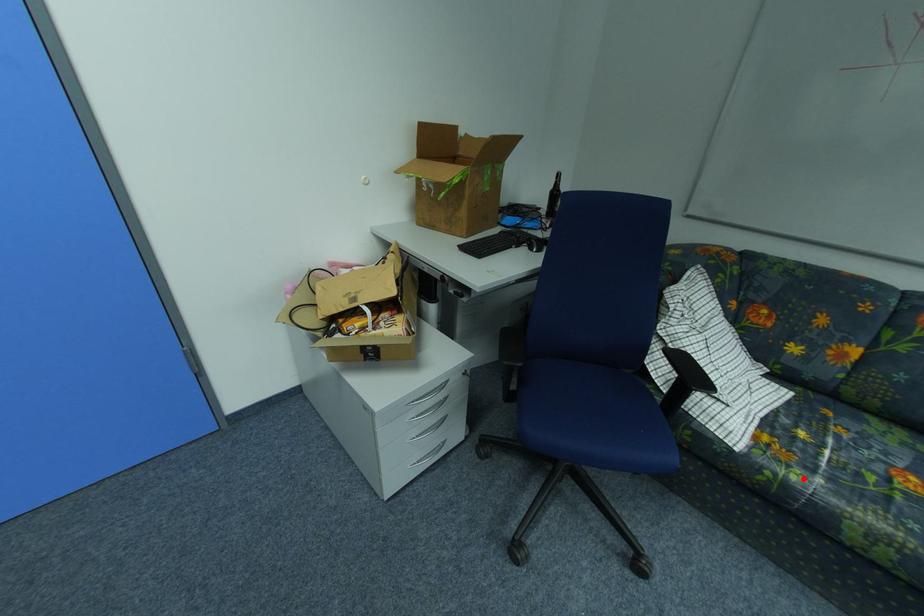
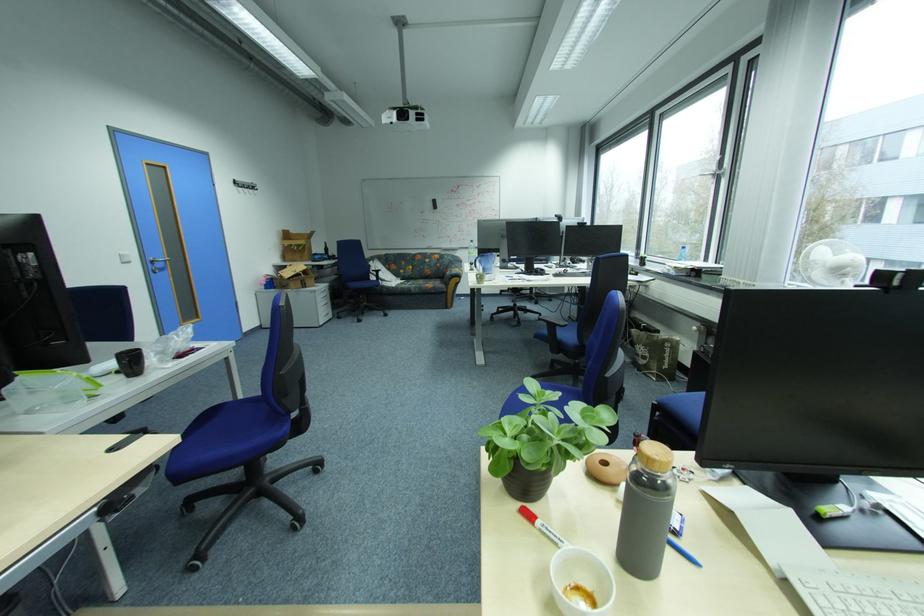
Where in the second image is the point corresponding to the highlighted location from the first image?

(411, 286)